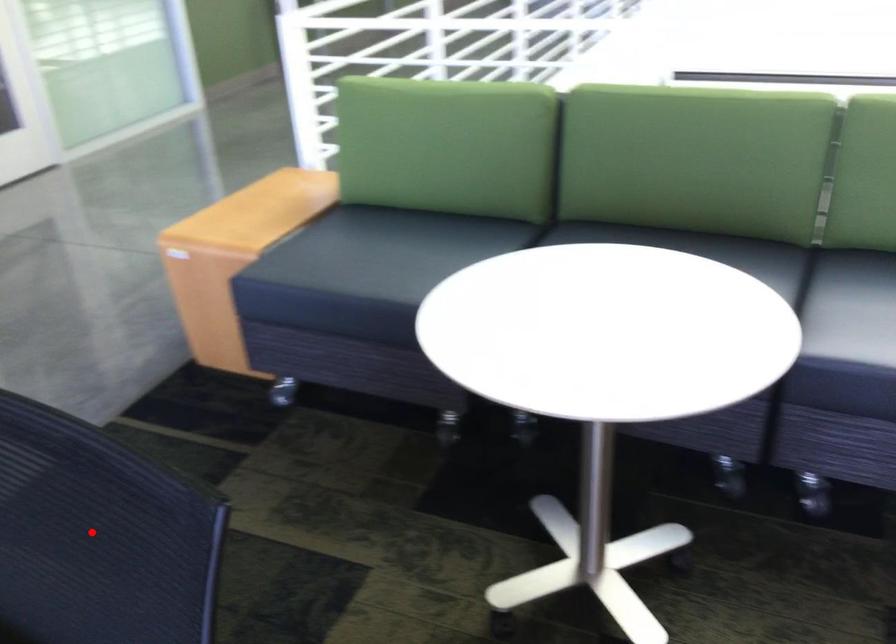
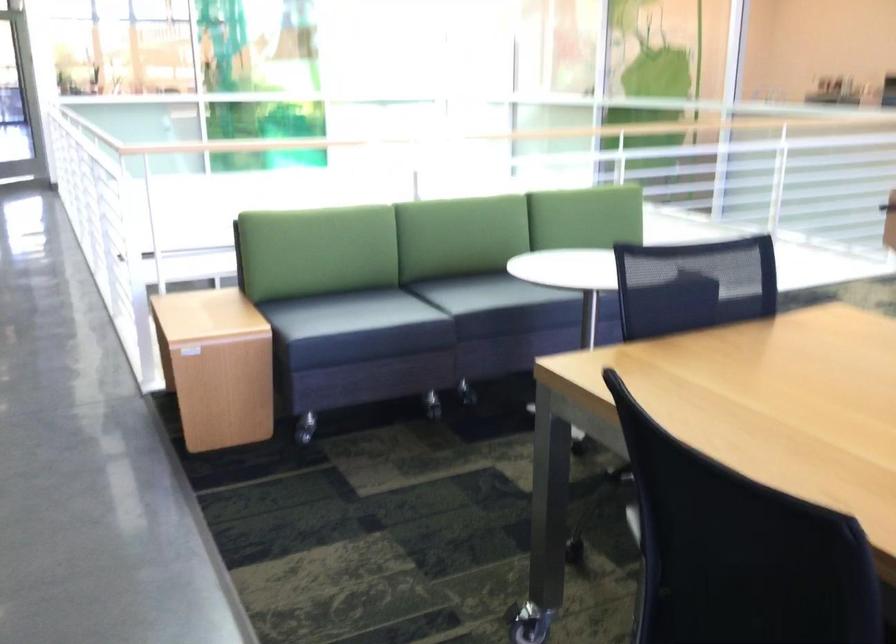
Question: I am providing you with two images of the same scene from different viewpoints. Given a red point in image1, look at the same physical point in image2. Is it:

Choices:
 (A) Closer to the viewpoint
 (B) Farther from the viewpoint

Answer: (B)